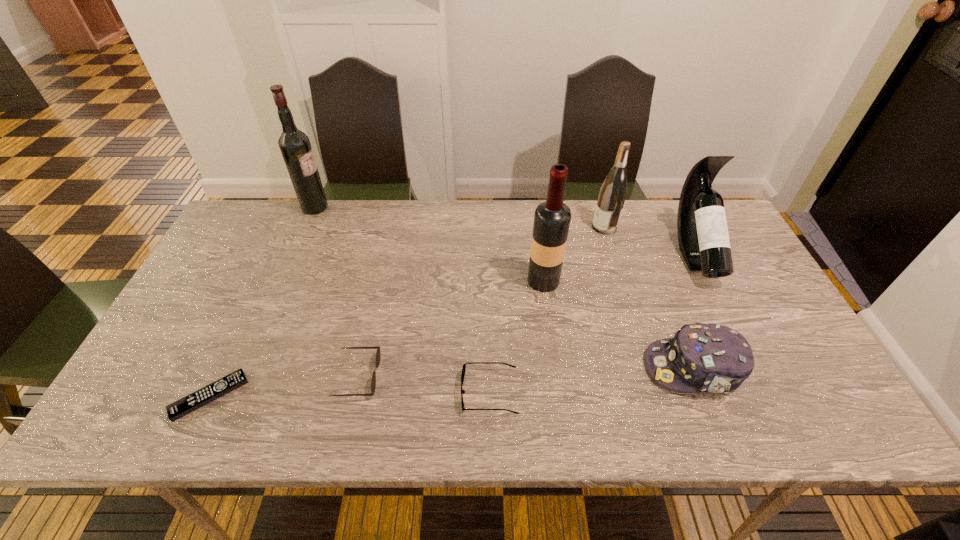
Where is `the farthest object`? This screenshot has width=960, height=540. the farthest object is located at coordinates (295, 147).

I want to click on the leftmost wine bottle, so click(295, 147).

This screenshot has width=960, height=540. In order to click on the third wine bottle from right to left in this screenshot , I will do `click(552, 218)`.

Identify the location of the second wine bottle from right to left. The image size is (960, 540). (612, 195).

Identify the location of the rightmost wine bottle. (703, 237).

Locate an element on the screen. headwear is located at coordinates (713, 358).

Locate an element on the screen. This screenshot has height=540, width=960. sunglasses is located at coordinates point(378,354).

You are a GUI agent. You are given a task and a screenshot of the screen. Output one action in this format:
    pyautogui.click(x=<x>, y=<y>)
    Task: Click on the sixth object from right to left
    
    Given the screenshot: What is the action you would take?
    pos(378,354)

Identify the location of spectacles. The width and height of the screenshot is (960, 540). (464, 365).

Identify the location of the seventh tallest object. The width and height of the screenshot is (960, 540). (464, 365).